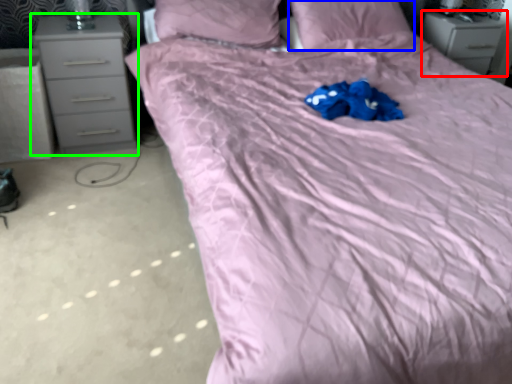
Question: Which is farther away from chest of drawers (highlighted by a red box)? pillow (highlighted by a blue box) or chest of drawers (highlighted by a green box)?

Choices:
 (A) pillow
 (B) chest of drawers

Answer: (B)